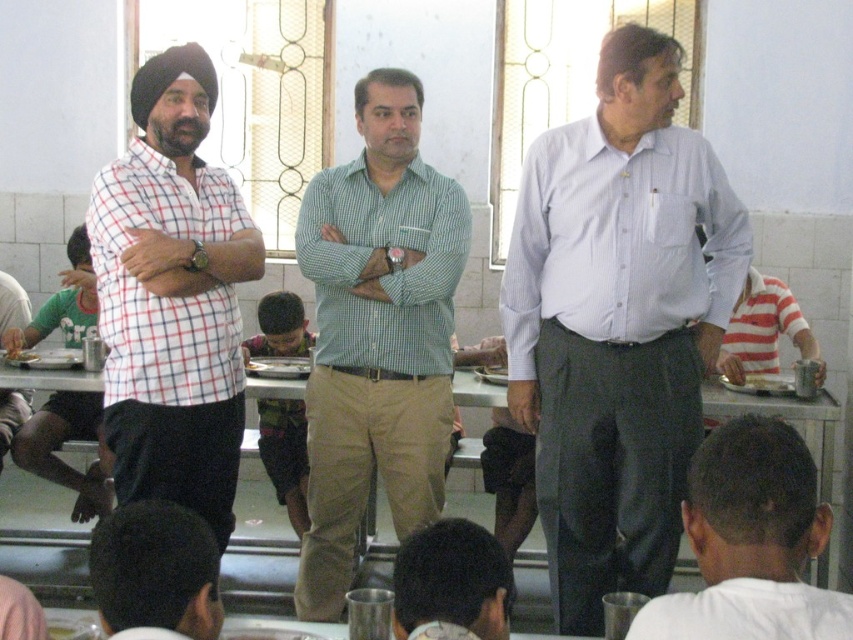
You are a photographer setting up a shoot in this dining area. You need to position a camera on a tripod so that it can capture both the white matte shirt at center and the metallic silver table at center in the frame. Based on their positions, can the camera be placed in a way that both objects are visible without moving either of them?

Yes, the camera can be positioned to capture both the white matte shirt at center and the metallic silver table at center because the white matte shirt at center is located above the metallic silver table at center, meaning they are vertically aligned and within the same field of view.